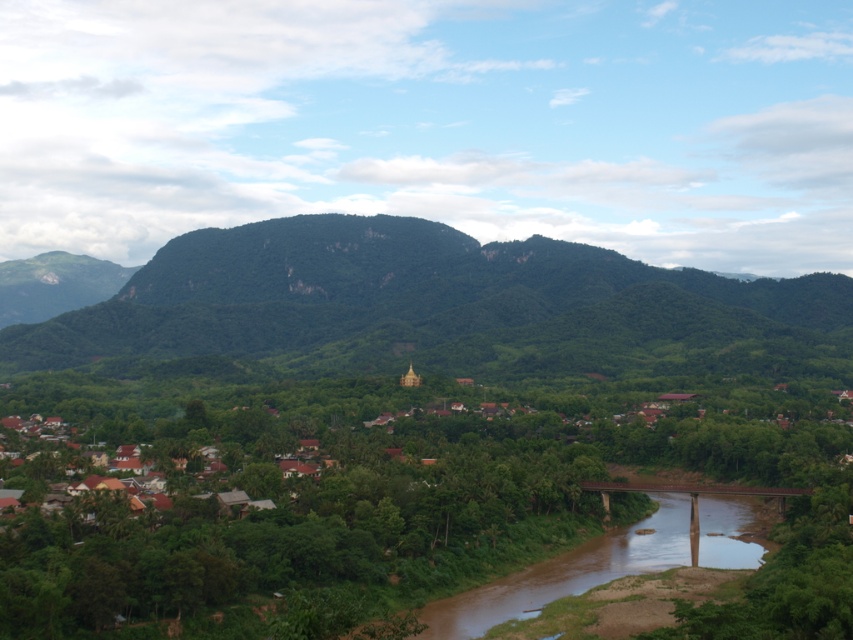
Question: Is green forested mountain at center positioned in front of brown muddy water at center?

Choices:
 (A) no
 (B) yes

Answer: (A)

Question: Can you confirm if green forested mountain at center is positioned above brown muddy water at center?

Choices:
 (A) yes
 (B) no

Answer: (A)

Question: Which point is closer to the camera?

Choices:
 (A) brown muddy water at center
 (B) green forested mountain at center

Answer: (A)

Question: Observing the image, what is the correct spatial positioning of green forested mountain at center in reference to brown muddy water at center?

Choices:
 (A) right
 (B) left

Answer: (B)